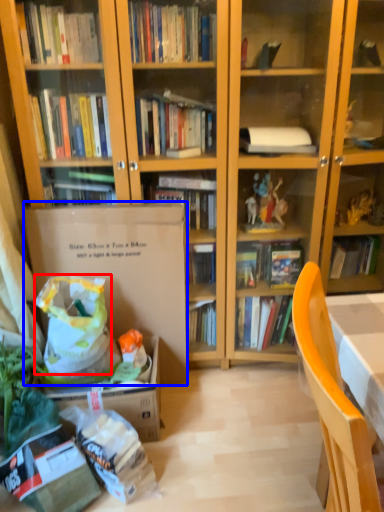
Question: Which point is further to the camera, grocery bag (highlighted by a red box) or paperback book (highlighted by a blue box)?

Choices:
 (A) grocery bag
 (B) paperback book

Answer: (B)